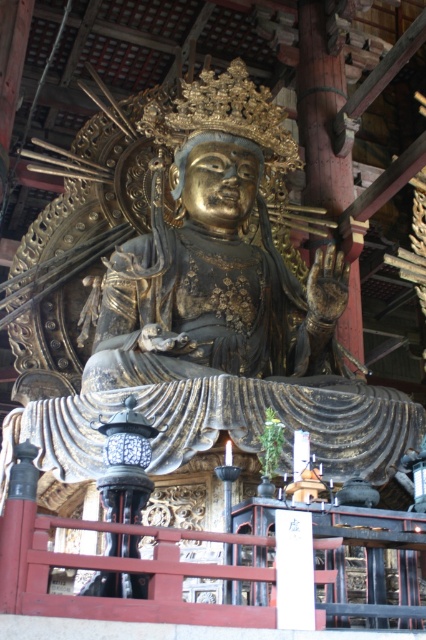
Question: Is gold/bronze statue at center to the right of gold/gilded statue at center from the viewer's perspective?

Choices:
 (A) no
 (B) yes

Answer: (A)

Question: Can you confirm if gold/bronze statue at center is positioned to the left of gold/gilded statue at center?

Choices:
 (A) no
 (B) yes

Answer: (B)

Question: Which point is farther from the camera taking this photo?

Choices:
 (A) (175, 326)
 (B) (281, 333)

Answer: (B)

Question: Does gold/bronze statue at center appear on the right side of gold/gilded statue at center?

Choices:
 (A) yes
 (B) no

Answer: (B)

Question: Which object appears farthest from the camera in this image?

Choices:
 (A) gold/bronze statue at center
 (B) gold/gilded statue at center

Answer: (B)

Question: Which of the following is the farthest from the observer?

Choices:
 (A) (204, 333)
 (B) (215, 241)

Answer: (B)